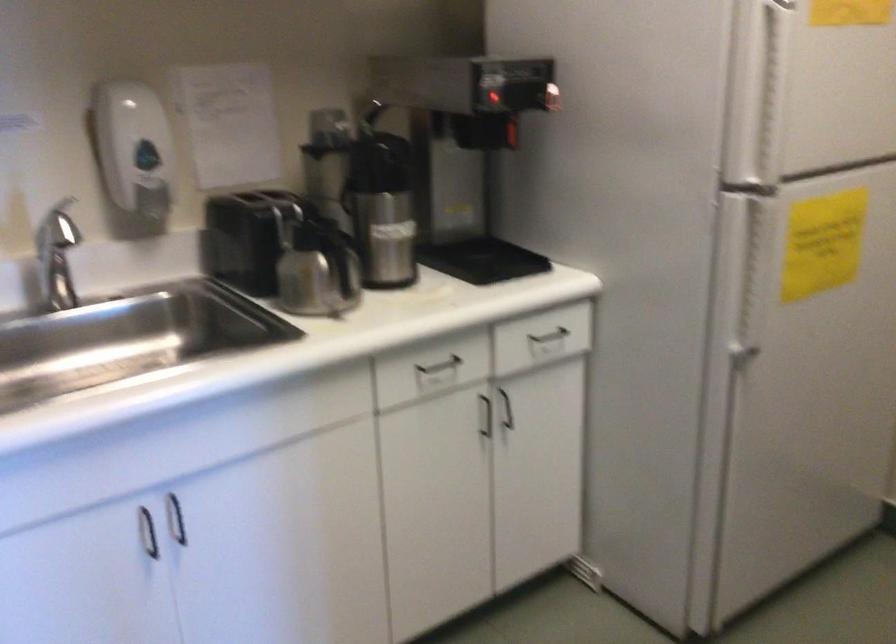
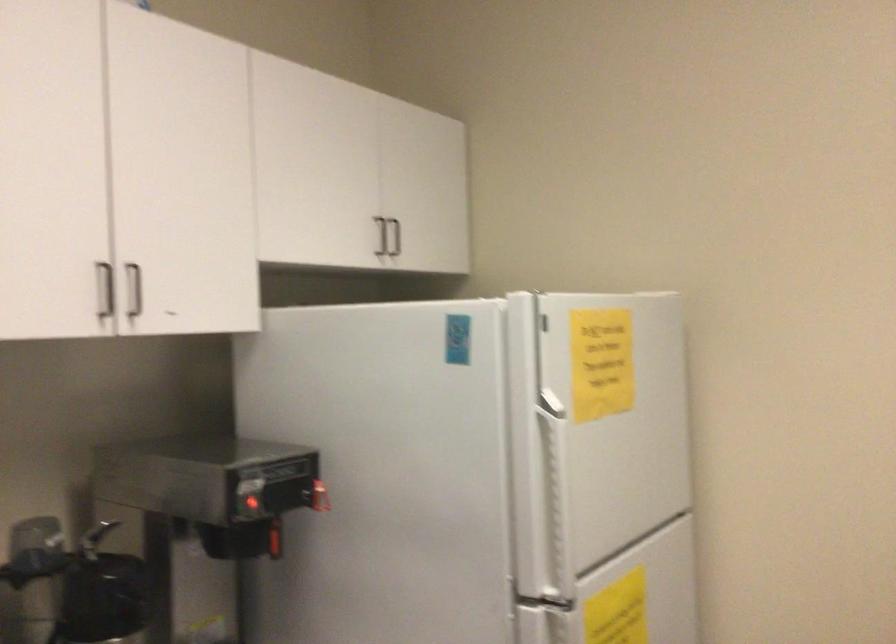
The images are taken continuously from a first-person perspective. In which direction is your viewpoint rotating?

The camera's rotation is toward right-up.